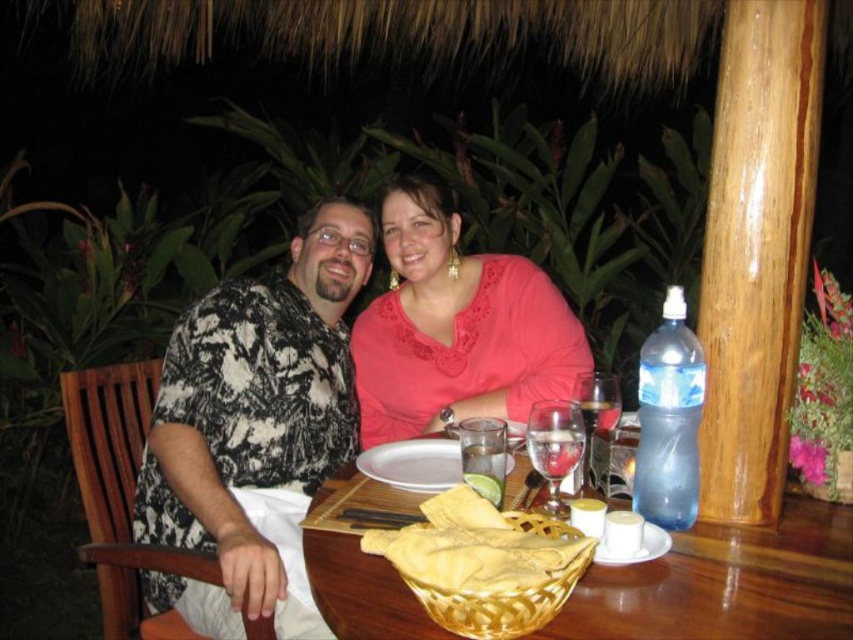
You are a waiter at a tropical restaurant and need to place a new drink order on the table. The table has a yellow wicker basket at table center. Where should you place the drink so it doesn not block the basket?

Place the drink away from the yellow wicker basket at table center, ensuring it is not obstructing the basket at its 2D location point at (476, 547).